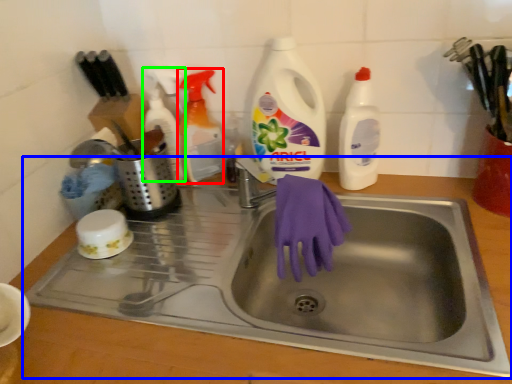
Question: Considering the real-world distances, which object is farthest from cleaning product (highlighted by a red box)? sink (highlighted by a blue box) or cleaning product (highlighted by a green box)?

Choices:
 (A) sink
 (B) cleaning product

Answer: (A)